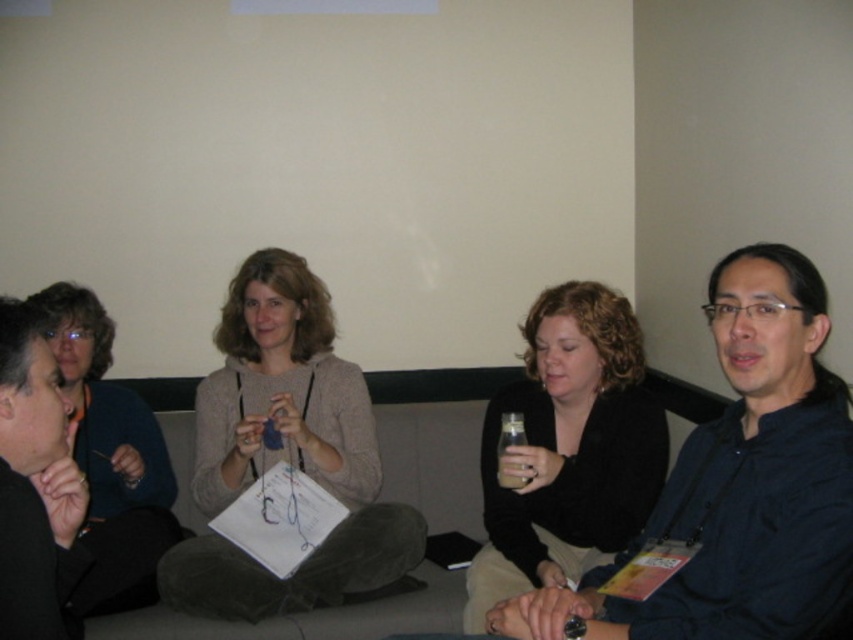
You are a photographer trying to capture a group photo of the matte blue sweater at left and the brown matte bottle at center. If you want to ensure both objects are fully visible in the frame, which object should you position closer to the camera?

The matte blue sweater at left might be wider than the brown matte bottle at center, so to ensure both are fully visible, position the matte blue sweater at left closer to the camera to avoid cropping it.

You are trying to determine if the matte blue sweater at left can fit into a storage box designed for the black matte jacket at left. Based on their widths, will the sweater fit?

The matte blue sweater at left is wider than the black matte jacket at left, so it may not fit into the storage box designed for the jacket.

You are a photographer trying to capture a candid shot of the group. You notice two sweaters in the scene. The knitted beige sweater at center and the matte blue sweater at left. Which sweater should you focus on if you want to ensure it appears in the foreground of your photo?

The knitted beige sweater at center is located above the matte blue sweater at left, so focusing on the knitted beige sweater at center would place it in the foreground since it is positioned higher in the frame.